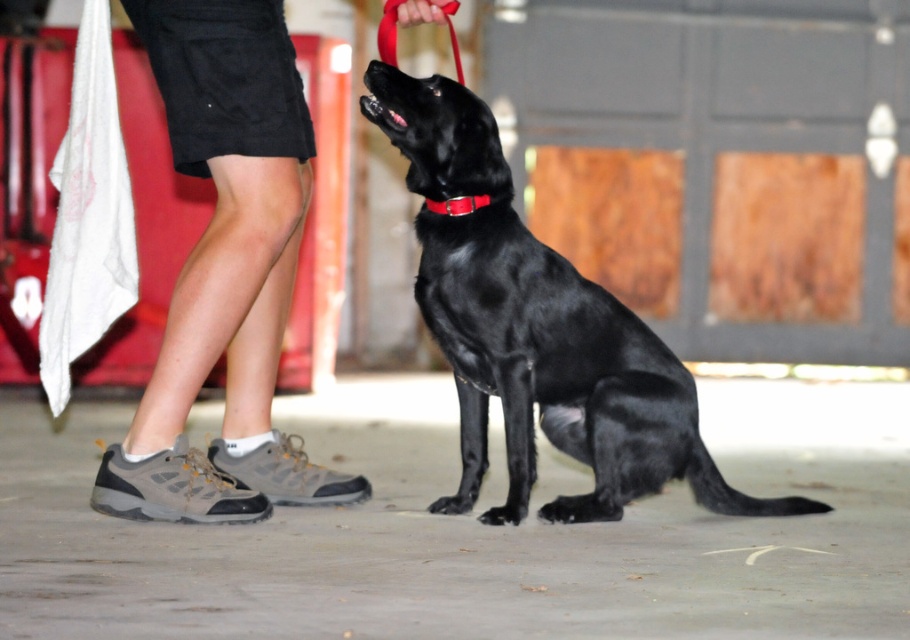
You are a delivery robot in a warehouse. You need to navigate around the gray fabric shoe at lower left and the red fabric leash at upper center. Which object has a wider base to avoid getting stuck?

The gray fabric shoe at lower left has a wider base than the red fabric leash at upper center, so you should avoid the gray fabric shoe at lower left to prevent getting stuck due to its wider base.

You are a dog trainer observing the scene. You need to determine if the shiny black dog at center can fit through a narrow doorway that is as wide as the red fabric leash at upper center. Can the dog fit?

The shiny black dog at center is wider than the red fabric leash at upper center. Since the doorway is as wide as the leash, the dog cannot fit through the narrow doorway.